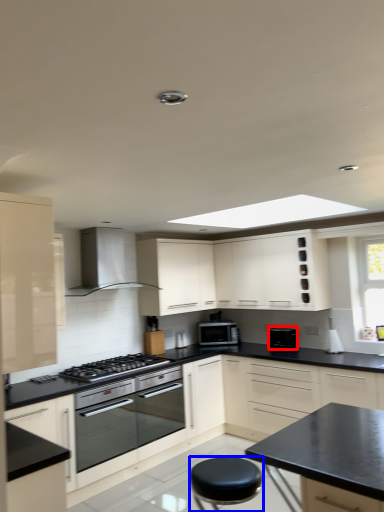
Question: Which of the following is the closest to the observer, appliance (highlighted by a red box) or stool (highlighted by a blue box)?

Choices:
 (A) appliance
 (B) stool

Answer: (B)